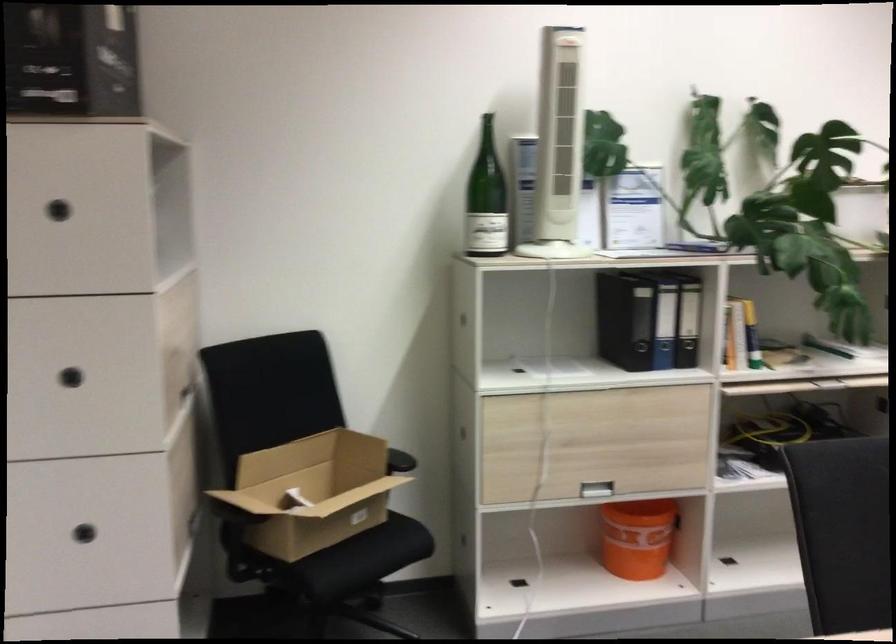
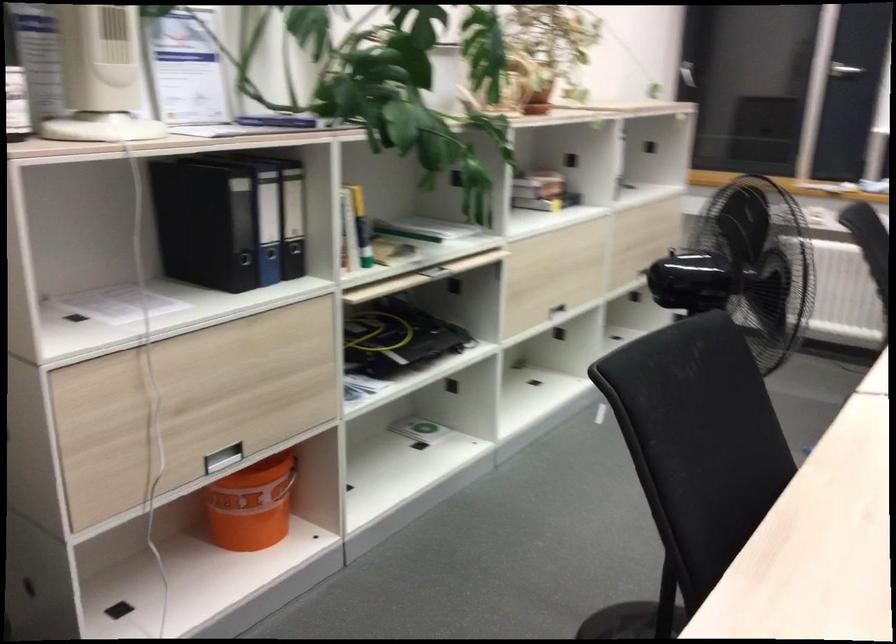
Question: The camera is either moving clockwise (left) or counter-clockwise (right) around the object. The first image is from the beginning of the video and the second image is from the end. Is the camera moving left or right when shooting the video?

Choices:
 (A) Left
 (B) Right

Answer: (A)